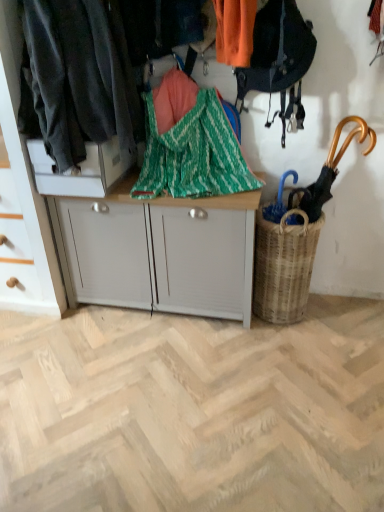
Question: Is white matte cabinet at left, which is counted as the second cabinetry, starting from the right, wider or thinner than green zigzag fabric at center?

Choices:
 (A) thin
 (B) wide

Answer: (B)

Question: Looking at the image, does white matte cabinet at left, which is counted as the second cabinetry, starting from the right, seem bigger or smaller compared to green zigzag fabric at center?

Choices:
 (A) small
 (B) big

Answer: (B)

Question: Which object is positioned farthest from the woven brown basket at lower right?

Choices:
 (A) dark gray fabric at left
 (B) wooden umbrella at right
 (C) white matte cabinet at center
 (D) green zigzag fabric at center
 (E) white matte cabinet at left, which is the first cabinetry from left to right

Answer: (E)

Question: Which of these objects is positioned farthest from the white matte cabinet at center?

Choices:
 (A) green zigzag fabric at center
 (B) white matte cabinet at upper left, which appears as the first cabinetry when viewed from the right
 (C) wooden umbrella at right
 (D) woven brown basket at lower right
 (E) white matte cabinet at left, which is the first cabinetry from left to right

Answer: (C)